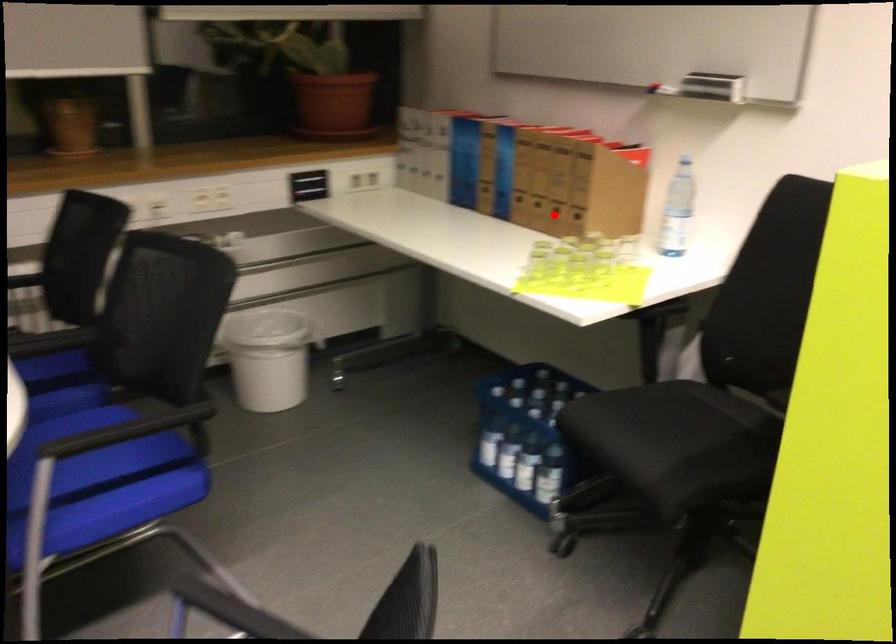
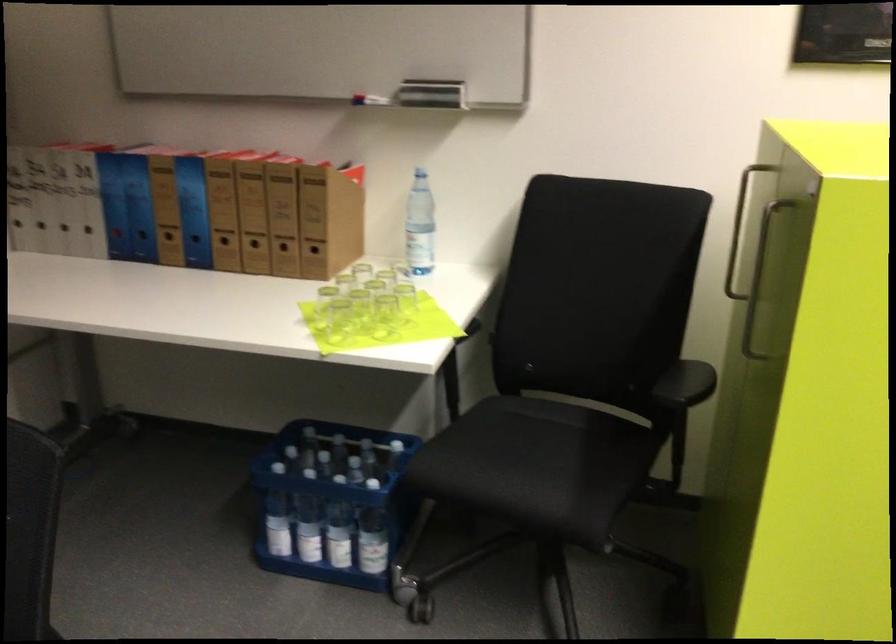
Question: A red point is marked in image1. In image2, is the corresponding 3D point closer to the camera or farther? Reply with the corresponding letter.

Choices:
 (A) The corresponding 3D point is closer.
 (B) The corresponding 3D point is farther.

Answer: (A)